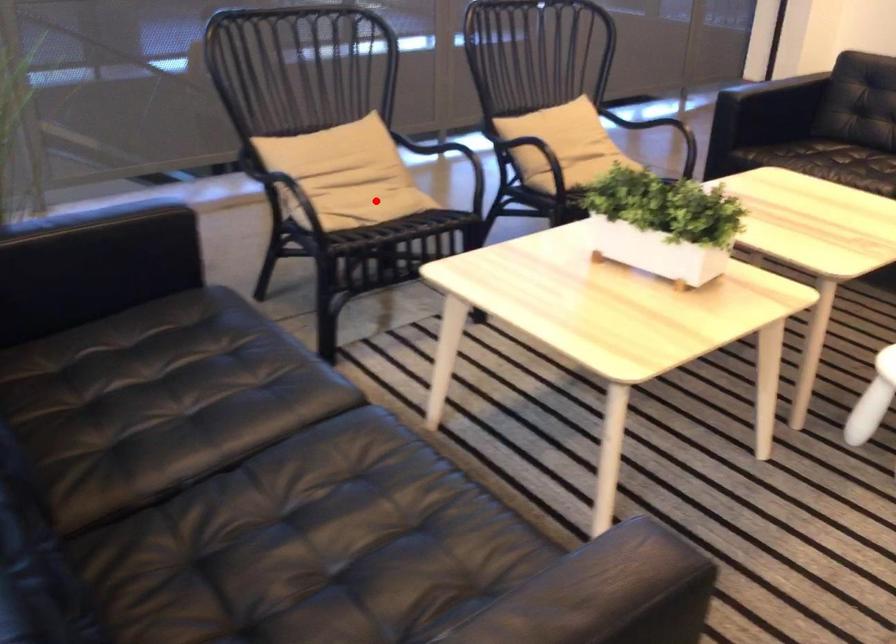
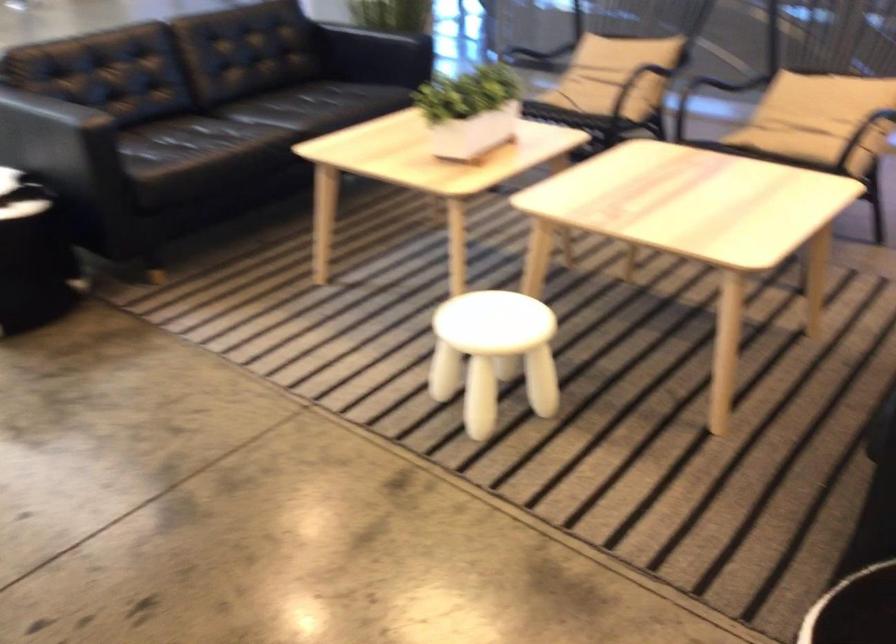
Locate, in the second image, the point that corresponds to the highlighted location in the first image.

(597, 91)